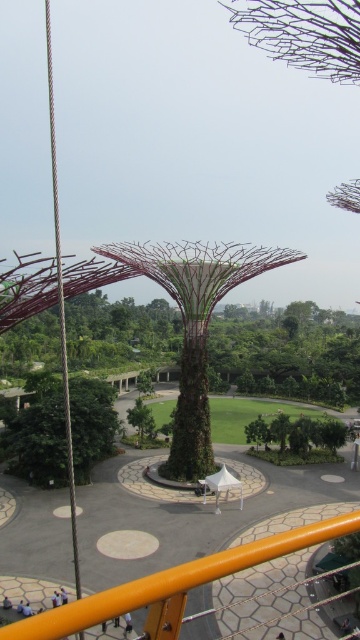
You are standing at the center of the circular pathway and want to reach both the point marked as point [38,456] and the point marked as point [138,417]. Which point should you walk towards first if you want to reach the one that is closer to you?

You should walk towards point [38,456] first because it is closer to your current position at the center of the circular pathway compared to point [138,417].

You are a visitor standing at the entrance of the botanical garden and see the green textured tree at lower left and the green textured tree at center. Which tree is positioned higher up in the image?

The green textured tree at lower left is above the green textured tree at center, so it is positioned higher up in the image.